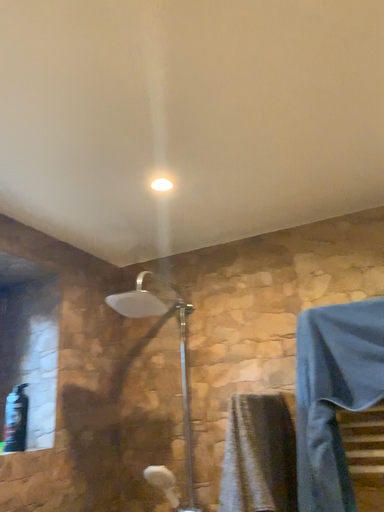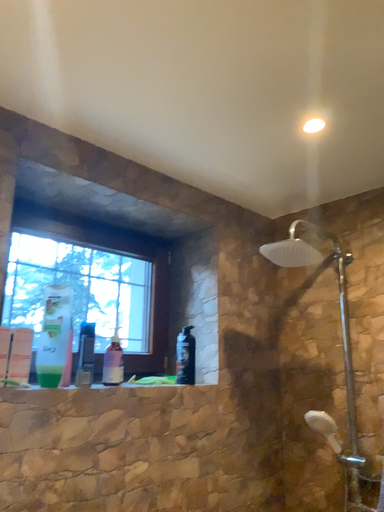
Question: Which way did the camera rotate in the video?

Choices:
 (A) rotated upward
 (B) rotated downward

Answer: (B)